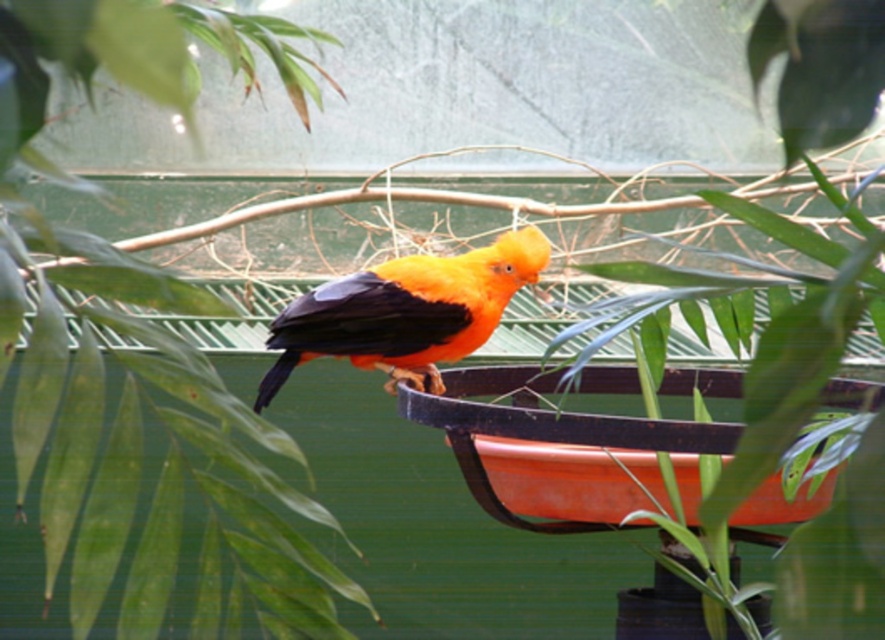
Question: Does green leafy plant at upper left have a larger size compared to orange matte/black feathers at center?

Choices:
 (A) yes
 (B) no

Answer: (A)

Question: Which point is farther from the camera taking this photo?

Choices:
 (A) [14, 179]
 (B) [514, 250]

Answer: (B)

Question: Which point is farther to the camera?

Choices:
 (A) orange matte/black feathers at center
 (B) green leafy plant at upper left

Answer: (A)

Question: Does green leafy plant at upper left come in front of orange matte/black feathers at center?

Choices:
 (A) yes
 (B) no

Answer: (A)

Question: Considering the relative positions of green leafy plant at upper left and orange matte/black feathers at center in the image provided, where is green leafy plant at upper left located with respect to orange matte/black feathers at center?

Choices:
 (A) below
 (B) above

Answer: (B)